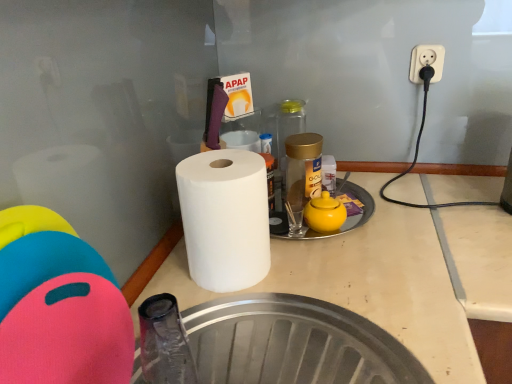
The image size is (512, 384). Identify the location of vacant region to the right of gold metallic jar at center, which appears as the second bottle when viewed from the back. (364, 202).